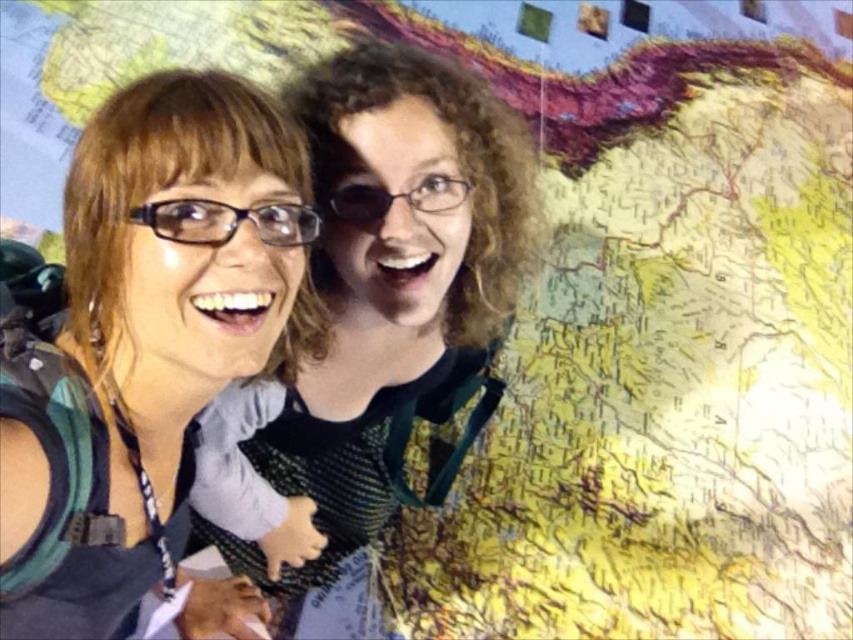
Question: Is matte black glasses at left smaller than matte black glasses at center?

Choices:
 (A) yes
 (B) no

Answer: (A)

Question: Is the position of matte black glasses at left less distant than that of matte black glasses at center?

Choices:
 (A) yes
 (B) no

Answer: (A)

Question: Which object appears farthest from the camera in this image?

Choices:
 (A) matte black glasses at left
 (B) matte black glasses at center

Answer: (B)

Question: Among these objects, which one is farthest from the camera?

Choices:
 (A) matte black glasses at center
 (B) matte black glasses at left

Answer: (A)

Question: Can you confirm if matte black glasses at left is thinner than matte black glasses at center?

Choices:
 (A) yes
 (B) no

Answer: (A)

Question: Which point appears closest to the camera in this image?

Choices:
 (A) (399, 339)
 (B) (236, 198)

Answer: (B)